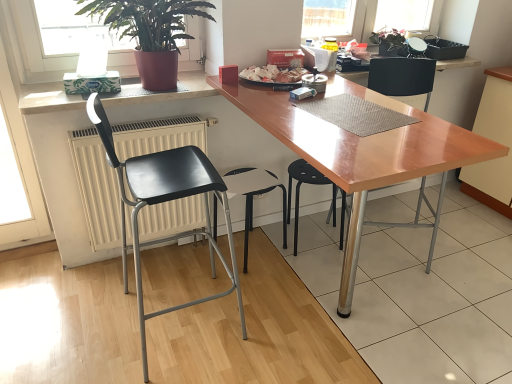
Where is `vacant point to the right of wooden table at center`? This screenshot has height=384, width=512. vacant point to the right of wooden table at center is located at coordinates (466, 273).